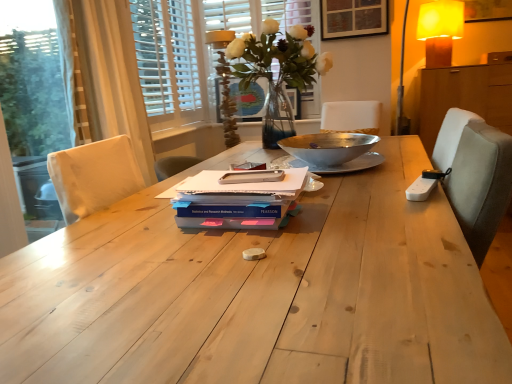
Question: Does white wooden blinds at upper left, the first bay window in the left-to-right sequence, have a greater width compared to white matte notebook at center, the 3th paperback book positioned from the bottom?

Choices:
 (A) no
 (B) yes

Answer: (A)

Question: Does white wooden blinds at upper left, which is the 2th bay window in right-to-left order, turn towards white matte notebook at center, the 3th paperback book positioned from the bottom?

Choices:
 (A) no
 (B) yes

Answer: (A)

Question: Does white wooden blinds at upper left, which is the 2th bay window in right-to-left order, lie behind white matte notebook at center, the 3th paperback book positioned from the bottom?

Choices:
 (A) no
 (B) yes

Answer: (B)

Question: Considering the relative positions of white wooden blinds at upper left, which is the 2th bay window in right-to-left order, and white matte notebook at center, positioned as the 1th paperback book in top-to-bottom order, in the image provided, is white wooden blinds at upper left, which is the 2th bay window in right-to-left order, to the left of white matte notebook at center, positioned as the 1th paperback book in top-to-bottom order, from the viewer's perspective?

Choices:
 (A) yes
 (B) no

Answer: (A)

Question: Is white matte notebook at center, the 3th paperback book positioned from the bottom, a part of white wooden blinds at upper left, which is the 2th bay window in right-to-left order?

Choices:
 (A) no
 (B) yes

Answer: (A)

Question: From a real-world perspective, relative to blue matte paperback book at center, the third paperback book viewed from the top, is white fabric curtain at left vertically above or below?

Choices:
 (A) above
 (B) below

Answer: (A)

Question: Would you say white fabric curtain at left is inside or outside blue matte paperback book at center, which appears as the first paperback book when ordered from the bottom?

Choices:
 (A) inside
 (B) outside

Answer: (B)

Question: Considering their positions, is white fabric curtain at left located in front of or behind blue matte paperback book at center, which appears as the first paperback book when ordered from the bottom?

Choices:
 (A) front
 (B) behind

Answer: (B)

Question: From the image's perspective, is white fabric curtain at left located above or below blue matte paperback book at center, the third paperback book viewed from the top?

Choices:
 (A) above
 (B) below

Answer: (A)

Question: From their relative heights in the image, would you say metallic silver bowl at center is taller or shorter than wooden picture frame at upper center?

Choices:
 (A) short
 (B) tall

Answer: (A)

Question: Based on their sizes in the image, would you say metallic silver bowl at center is bigger or smaller than wooden picture frame at upper center?

Choices:
 (A) small
 (B) big

Answer: (B)

Question: Relative to wooden picture frame at upper center, is metallic silver bowl at center in front or behind?

Choices:
 (A) front
 (B) behind

Answer: (A)

Question: Is point (322, 140) closer or farther from the camera than point (334, 21)?

Choices:
 (A) closer
 (B) farther

Answer: (A)

Question: Looking at their shapes, would you say blue matte paperback book at center, the third paperback book viewed from the top, is wider or thinner than translucent glass vase at center?

Choices:
 (A) wide
 (B) thin

Answer: (B)

Question: From a real-world perspective, relative to translucent glass vase at center, is blue matte paperback book at center, which appears as the first paperback book when ordered from the bottom, vertically above or below?

Choices:
 (A) above
 (B) below

Answer: (B)